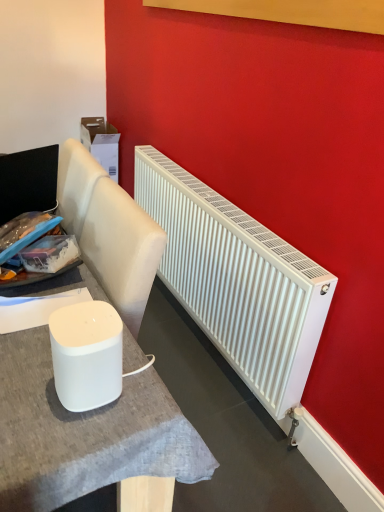
At what (x,y) coordinates should I click in order to perform the action: click on empty space that is ontop of white matte radiator at right. Please return your answer as a coordinate pair (x, y). This screenshot has height=512, width=384. Looking at the image, I should click on (224, 205).